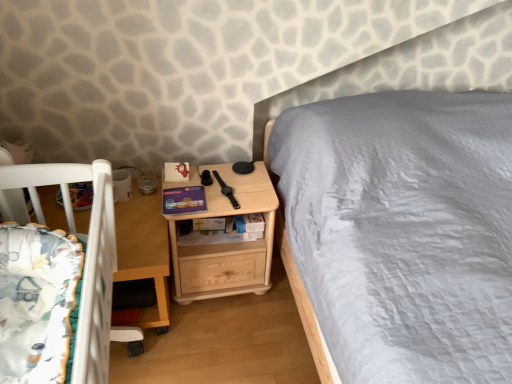
This screenshot has height=384, width=512. I want to click on wooden table at lower left, so click(144, 254).

How much distance is there between fluffy white blanket at lower left and wooden table at lower left?

9.91 inches.

Is wooden table at lower left at the back of fluffy white blanket at lower left?

That's not correct — fluffy white blanket at lower left is not looking away from wooden table at lower left.

Considering the relative positions of fluffy white blanket at lower left and wooden table at lower left in the image provided, is fluffy white blanket at lower left to the left or to the right of wooden table at lower left?

fluffy white blanket at lower left is to the right of wooden table at lower left.

Do you think fluffy white blanket at lower left is within wooden table at lower left, or outside of it?

The correct answer is: outside.

From the image's perspective, which one is positioned lower, light wood/texture nightstand at center or wooden table at lower left?

wooden table at lower left.

Who is more distant, light wood/texture nightstand at center or wooden table at lower left?

light wood/texture nightstand at center is more distant.

The width and height of the screenshot is (512, 384). Identify the location of table located below the light wood/texture nightstand at center (from the image's perspective). (144, 254).

Can wooden table at lower left be found inside light wood/texture nightstand at center?

That's incorrect, wooden table at lower left is not inside light wood/texture nightstand at center.

Considering the points (140, 242) and (204, 266), which point is behind, point (140, 242) or point (204, 266)?

Positioned behind is point (204, 266).

Is wooden table at lower left wider or thinner than light wood/texture nightstand at center?

In the image, wooden table at lower left appears to be wider than light wood/texture nightstand at center.

From a real-world perspective, is wooden table at lower left above or below light wood/texture nightstand at center?

In terms of real-world spatial position, wooden table at lower left is below light wood/texture nightstand at center.

Where is `nightstand located above the wooden table at lower left (from the image's perspective)`? This screenshot has height=384, width=512. nightstand located above the wooden table at lower left (from the image's perspective) is located at coordinates (225, 243).

Is point (106, 226) positioned before point (189, 284)?

Yes.

From the image's perspective, between fluffy white blanket at lower left and light wood/texture nightstand at center, which one is located above?

light wood/texture nightstand at center.

Considering the positions of objects fluffy white blanket at lower left and light wood/texture nightstand at center in the image provided, who is in front, fluffy white blanket at lower left or light wood/texture nightstand at center?

fluffy white blanket at lower left is in front.

Looking at this image, in terms of width, does fluffy white blanket at lower left look wider or thinner when compared to light wood/texture nightstand at center?

fluffy white blanket at lower left is thinner than light wood/texture nightstand at center.

Can you confirm if wooden table at lower left is thinner than fluffy white blanket at lower left?

No, wooden table at lower left is not thinner than fluffy white blanket at lower left.

From a real-world perspective, is wooden table at lower left on top of fluffy white blanket at lower left?

Incorrect, from a real-world perspective, wooden table at lower left is lower than fluffy white blanket at lower left.

Is wooden table at lower left at the right side of fluffy white blanket at lower left?

No, wooden table at lower left is not to the right of fluffy white blanket at lower left.

Is wooden table at lower left looking in the opposite direction of fluffy white blanket at lower left?

No, wooden table at lower left is not facing away from fluffy white blanket at lower left.

Is light wood/texture nightstand at center taller or shorter than fluffy white blanket at lower left?

In the image, light wood/texture nightstand at center appears to be taller than fluffy white blanket at lower left.

Who is more distant, light wood/texture nightstand at center or fluffy white blanket at lower left?

light wood/texture nightstand at center is further away from the camera.

Are light wood/texture nightstand at center and fluffy white blanket at lower left located far from each other?

No, light wood/texture nightstand at center is not far from fluffy white blanket at lower left.

At what (x,y) coordinates should I click in order to perform the action: click on infant bed that is in front of the wooden table at lower left. Please return your answer as a coordinate pair (x, y). Looking at the image, I should click on (87, 254).

Image resolution: width=512 pixels, height=384 pixels. I want to click on table below the light wood/texture nightstand at center (from a real-world perspective), so pyautogui.click(x=144, y=254).

Based on their spatial positions, is wooden table at lower left or fluffy white blanket at lower left further from light wood/texture nightstand at center?

Among the two, fluffy white blanket at lower left is located further to light wood/texture nightstand at center.

Estimate the real-world distances between objects in this image. Which object is further from wooden table at lower left, light wood/texture nightstand at center or fluffy white blanket at lower left?

The object further to wooden table at lower left is fluffy white blanket at lower left.

When comparing their distances from wooden table at lower left, does fluffy white blanket at lower left or light wood/texture nightstand at center seem further?

Based on the image, fluffy white blanket at lower left appears to be further to wooden table at lower left.

Consider the image. Looking at the image, which one is located further to fluffy white blanket at lower left, light wood/texture nightstand at center or wooden table at lower left?

light wood/texture nightstand at center.

From the image, which object appears to be nearer to light wood/texture nightstand at center, fluffy white blanket at lower left or wooden table at lower left?

wooden table at lower left lies closer to light wood/texture nightstand at center than the other object.

Looking at the image, which one is located closer to fluffy white blanket at lower left, wooden table at lower left or light wood/texture nightstand at center?

Among the two, wooden table at lower left is located nearer to fluffy white blanket at lower left.

Where is `table between fluffy white blanket at lower left and light wood/texture nightstand at center in the front-back direction`? This screenshot has height=384, width=512. table between fluffy white blanket at lower left and light wood/texture nightstand at center in the front-back direction is located at coordinates (144, 254).